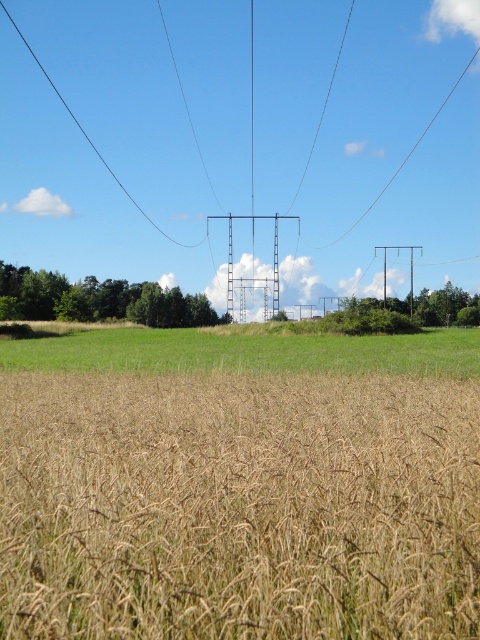
Which is behind, point (436, 330) or point (444, 316)?

The point (444, 316) is more distant.

Is green grass at center closer to the viewer compared to green leafy tree at right?

Yes.

Does point (384, 355) lie in front of point (445, 304)?

Yes, it is.

Where is `green grass at center`? The height and width of the screenshot is (640, 480). green grass at center is located at coordinates (247, 353).

Is brown matte wheat field at center smaller than green leafy tree at lower left?

Correct, brown matte wheat field at center occupies less space than green leafy tree at lower left.

Between point (391, 406) and point (192, 300), which one is positioned in front?

Point (391, 406) is in front.

The image size is (480, 640). In order to click on brown matte wheat field at center in this screenshot , I will do `click(239, 508)`.

Can you confirm if green grass at center is bigger than green leafy tree at lower left?

No.

Is green grass at center further to camera compared to green leafy tree at lower left?

No, green grass at center is closer to the viewer.

Who is more distant from viewer, (217,355) or (119,305)?

Positioned behind is point (119,305).

At what (x,y) coordinates should I click in order to perform the action: click on green grass at center. Please return your answer as a coordinate pair (x, y). This screenshot has height=640, width=480. Looking at the image, I should click on (247, 353).